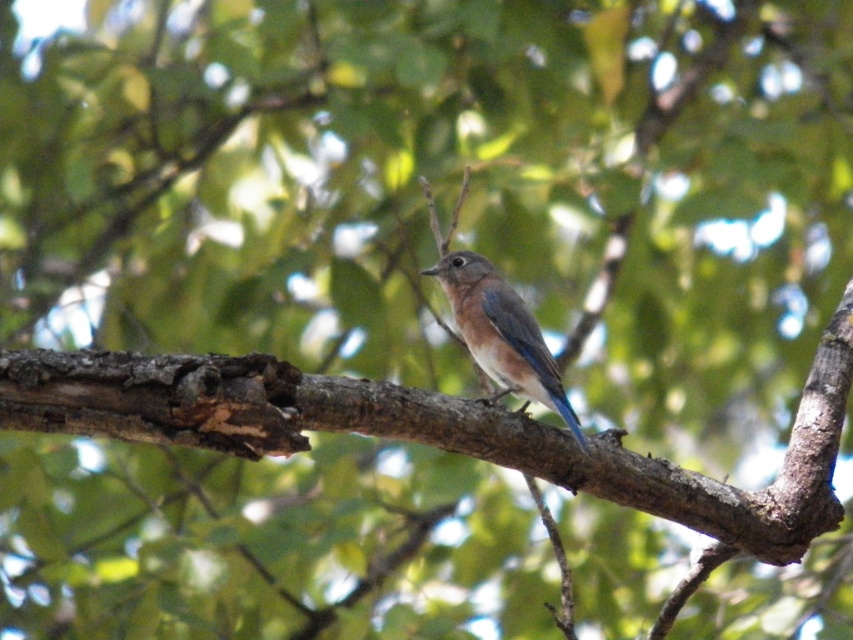
Does brown rough tree branch at center have a lesser width compared to blue glossy bird at center?

No, brown rough tree branch at center is not thinner than blue glossy bird at center.

Does brown rough tree branch at center appear over blue glossy bird at center?

No, brown rough tree branch at center is not above blue glossy bird at center.

Between point (627, 496) and point (514, 289), which one is positioned behind?

Positioned behind is point (514, 289).

Identify the location of brown rough tree branch at center. The width and height of the screenshot is (853, 640). (434, 429).